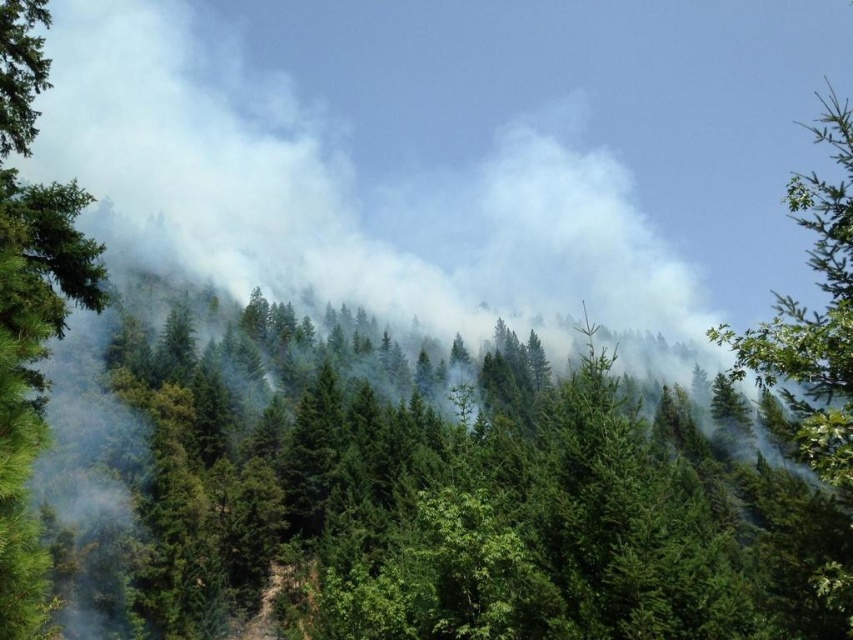
Question: Can you confirm if green matte tree at left is wider than green leafy tree at upper right?

Choices:
 (A) yes
 (B) no

Answer: (A)

Question: Does green matte tree at left appear over green leafy tree at upper right?

Choices:
 (A) yes
 (B) no

Answer: (A)

Question: Among these objects, which one is farthest from the camera?

Choices:
 (A) green matte tree at left
 (B) green leafy tree at upper right

Answer: (B)

Question: Which object appears closest to the camera in this image?

Choices:
 (A) green leafy tree at upper right
 (B) green matte tree at left

Answer: (B)

Question: Is green matte tree at left positioned before green leafy tree at upper right?

Choices:
 (A) yes
 (B) no

Answer: (A)